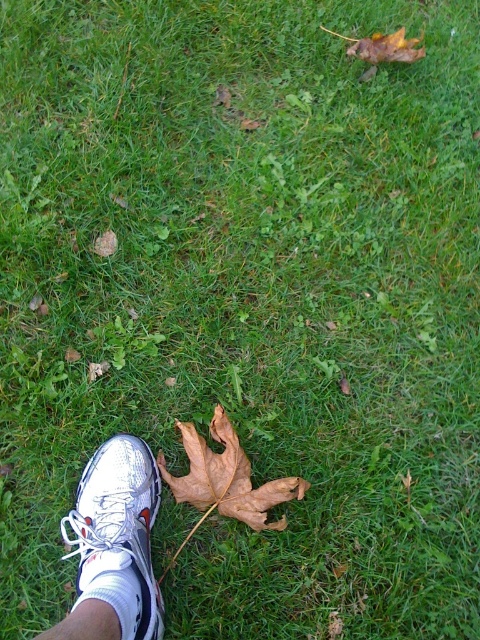
Does white mesh shoe at lower left have a greater width compared to brown papery maple leaf at lower center?

Incorrect, white mesh shoe at lower left's width does not surpass brown papery maple leaf at lower center's.

Where is `white mesh shoe at lower left`? white mesh shoe at lower left is located at coordinates (118, 534).

Find the location of `white mesh shoe at lower left`. white mesh shoe at lower left is located at coordinates (118, 534).